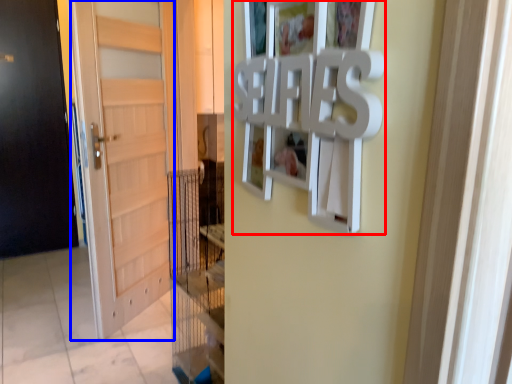
Question: Which of the following is the farthest to the observer, picture frame (highlighted by a red box) or door (highlighted by a blue box)?

Choices:
 (A) picture frame
 (B) door

Answer: (B)